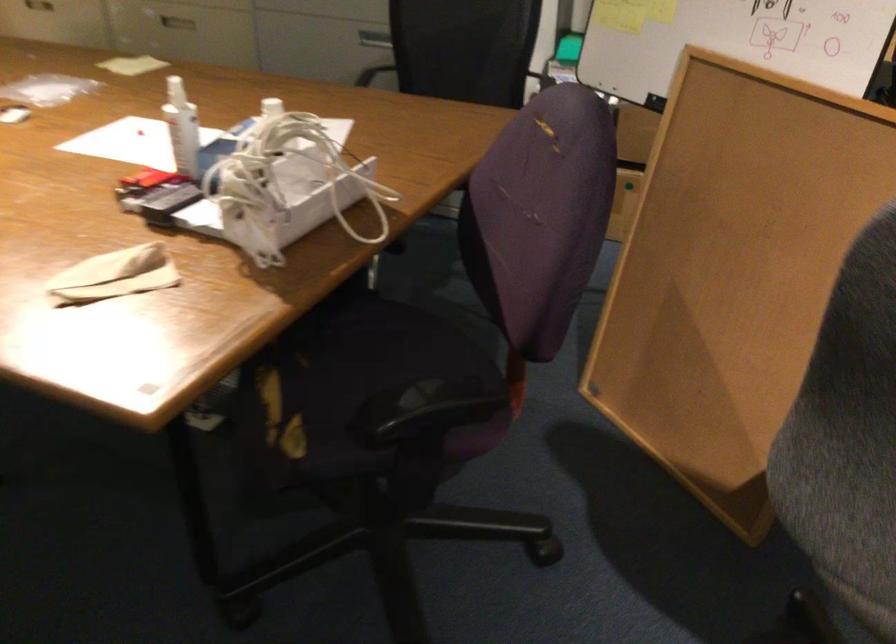
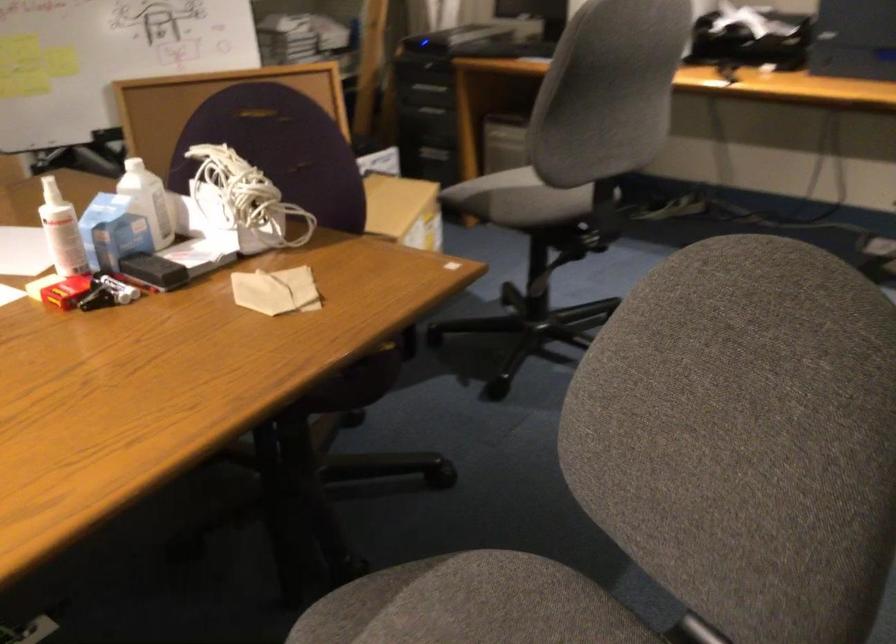
Question: I am providing you with two images of the same scene from different viewpoints. Which of the following objects are not visible in image2?

Choices:
 (A) red cigarette box
 (B) yellow tennis ball can
 (C) chair sitting surface
 (D) white spray bottle

Answer: (C)